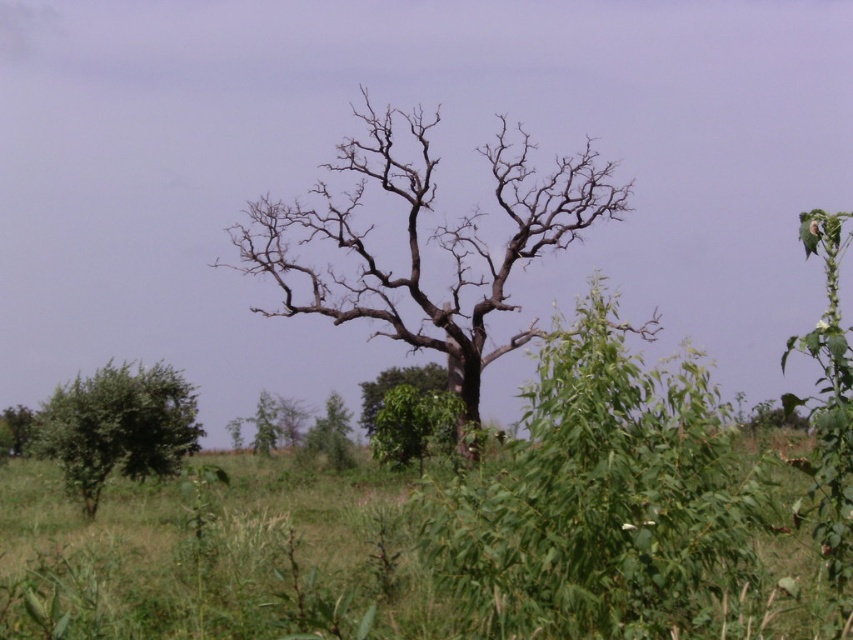
In the scene shown: You are standing at the center of the image facing the large tree. You want to walk to the green leafy shrub at lower left. Which direction should you turn to face the shrub?

The green leafy shrub at lower left is located at coordinates 0.667 on the x axis and 0.140 on the y axis. Since you are facing the large tree at the center, turning to your left would orient you towards the lower left direction, where the shrub is situated.